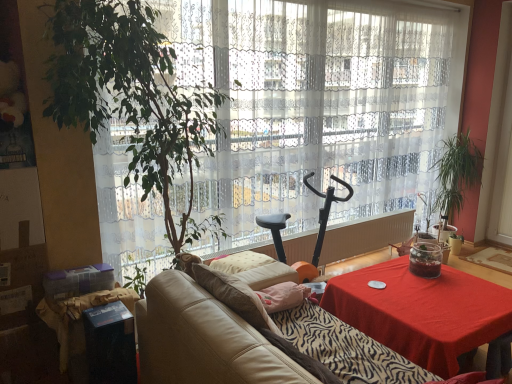
Question: Should I look upward or downward to see translucent glass jar at center?

Choices:
 (A) up
 (B) down

Answer: (B)

Question: Does leather couch at center come behind black cardboard box at lower left?

Choices:
 (A) yes
 (B) no

Answer: (B)

Question: Is there a large distance between leather couch at center and black cardboard box at lower left?

Choices:
 (A) yes
 (B) no

Answer: (B)

Question: Can you confirm if leather couch at center is wider than black cardboard box at lower left?

Choices:
 (A) no
 (B) yes

Answer: (B)

Question: Considering the relative sizes of leather couch at center and black cardboard box at lower left in the image provided, is leather couch at center thinner than black cardboard box at lower left?

Choices:
 (A) no
 (B) yes

Answer: (A)

Question: Does leather couch at center have a smaller size compared to black cardboard box at lower left?

Choices:
 (A) no
 (B) yes

Answer: (A)

Question: Does leather couch at center have a greater height compared to black cardboard box at lower left?

Choices:
 (A) yes
 (B) no

Answer: (A)

Question: From the image's perspective, is black cardboard box at lower left on top of transparent lace curtain at center?

Choices:
 (A) no
 (B) yes

Answer: (A)

Question: Does black cardboard box at lower left have a lesser height compared to transparent lace curtain at center?

Choices:
 (A) yes
 (B) no

Answer: (A)

Question: Does black cardboard box at lower left have a greater width compared to transparent lace curtain at center?

Choices:
 (A) yes
 (B) no

Answer: (B)

Question: Considering the relative sizes of black cardboard box at lower left and transparent lace curtain at center in the image provided, is black cardboard box at lower left thinner than transparent lace curtain at center?

Choices:
 (A) yes
 (B) no

Answer: (A)

Question: Can you confirm if black cardboard box at lower left is taller than transparent lace curtain at center?

Choices:
 (A) yes
 (B) no

Answer: (B)

Question: Can you confirm if black cardboard box at lower left is bigger than transparent lace curtain at center?

Choices:
 (A) yes
 (B) no

Answer: (B)

Question: Can translucent glass jar at center be found inside black cardboard box at lower left?

Choices:
 (A) yes
 (B) no

Answer: (B)